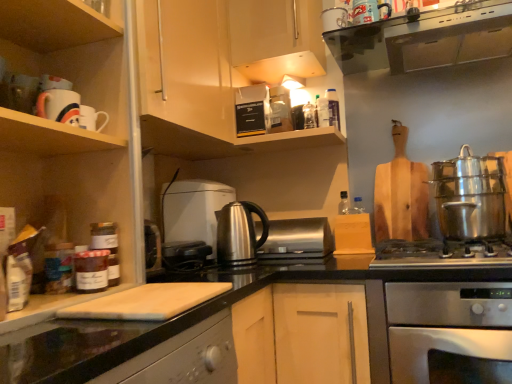
Question: Is stainless steel oven at lower right at the right side of wooden cutting board at upper left, the third cabinetry when ordered from back to front?

Choices:
 (A) no
 (B) yes

Answer: (B)

Question: Considering the relative sizes of stainless steel oven at lower right and wooden cutting board at upper left, acting as the first cabinetry starting from the front, in the image provided, is stainless steel oven at lower right wider than wooden cutting board at upper left, acting as the first cabinetry starting from the front,?

Choices:
 (A) yes
 (B) no

Answer: (A)

Question: Considering the relative positions of stainless steel oven at lower right and wooden cutting board at upper left, acting as the first cabinetry starting from the front, in the image provided, is stainless steel oven at lower right in front of wooden cutting board at upper left, acting as the first cabinetry starting from the front,?

Choices:
 (A) yes
 (B) no

Answer: (B)

Question: From the image's perspective, would you say stainless steel oven at lower right is shown under wooden cutting board at upper left, the third cabinetry when ordered from back to front?

Choices:
 (A) yes
 (B) no

Answer: (A)

Question: Can you confirm if stainless steel oven at lower right is taller than wooden cutting board at upper left, acting as the first cabinetry starting from the front?

Choices:
 (A) yes
 (B) no

Answer: (B)

Question: Considering the positions of stainless steel kettle at center, the 2th kitchen appliance from the back, and black glass range hood at upper center in the image, is stainless steel kettle at center, the 2th kitchen appliance from the back, wider or thinner than black glass range hood at upper center?

Choices:
 (A) thin
 (B) wide

Answer: (A)

Question: Is stainless steel kettle at center, the 2th kitchen appliance from the back, taller or shorter than black glass range hood at upper center?

Choices:
 (A) tall
 (B) short

Answer: (A)

Question: From a real-world perspective, is stainless steel kettle at center, the 2th kitchen appliance from the back, positioned above or below black glass range hood at upper center?

Choices:
 (A) above
 (B) below

Answer: (B)

Question: Is point (237, 216) positioned closer to the camera than point (480, 21)?

Choices:
 (A) farther
 (B) closer

Answer: (A)

Question: From the image's perspective, is wooden cutting board at upper left, acting as the first cabinetry starting from the front, positioned above or below satin silver toaster at center, the second appliance viewed from the top?

Choices:
 (A) below
 (B) above

Answer: (B)

Question: Considering the positions of wooden cutting board at upper left, the third cabinetry when ordered from back to front, and satin silver toaster at center, the first appliance in the bottom-to-top sequence, in the image, is wooden cutting board at upper left, the third cabinetry when ordered from back to front, taller or shorter than satin silver toaster at center, the first appliance in the bottom-to-top sequence,?

Choices:
 (A) short
 (B) tall

Answer: (B)

Question: Is wooden cutting board at upper left, the third cabinetry when ordered from back to front, in front of or behind satin silver toaster at center, the first appliance in the bottom-to-top sequence, in the image?

Choices:
 (A) front
 (B) behind

Answer: (A)

Question: Would you say wooden cutting board at upper left, acting as the first cabinetry starting from the front, is inside or outside satin silver toaster at center, which is the 1th appliance in front-to-back order?

Choices:
 (A) inside
 (B) outside

Answer: (B)

Question: Is black granite countertop at center inside or outside of metallic silver toaster at upper center, the 1th appliance when ordered from top to bottom?

Choices:
 (A) outside
 (B) inside

Answer: (A)

Question: In the image, is black granite countertop at center positioned in front of or behind metallic silver toaster at upper center, acting as the 2th appliance starting from the bottom?

Choices:
 (A) front
 (B) behind

Answer: (A)